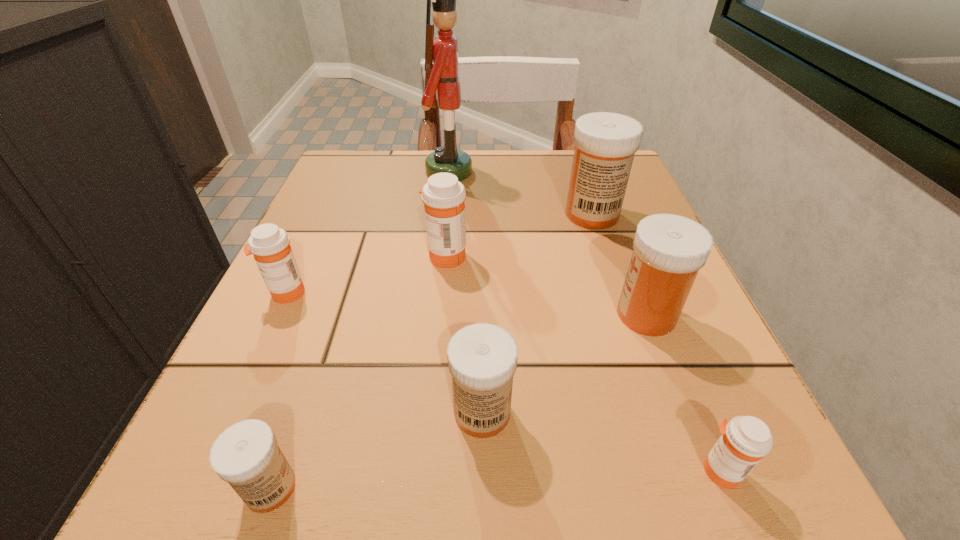
This screenshot has width=960, height=540. I want to click on orange medicine that is the second closest one to the tallest medicine, so click(745, 440).

The height and width of the screenshot is (540, 960). Find the location of `vacant area in the image that satisfies the following two spatial constraints: 1. on the back side of the second smallest white medicine; 2. on the front-facing side of the nutcracker`. vacant area in the image that satisfies the following two spatial constraints: 1. on the back side of the second smallest white medicine; 2. on the front-facing side of the nutcracker is located at coordinates (481, 172).

This screenshot has height=540, width=960. I want to click on free space that satisfies the following two spatial constraints: 1. on the back side of the second farthest object; 2. on the front-facing side of the farthest object, so click(578, 172).

The width and height of the screenshot is (960, 540). Find the location of `free region that satisfies the following two spatial constraints: 1. on the front-facing side of the green nutcracker; 2. on the front side of the leftmost medicine`. free region that satisfies the following two spatial constraints: 1. on the front-facing side of the green nutcracker; 2. on the front side of the leftmost medicine is located at coordinates (436, 292).

Where is `vacant area in the image that satisfies the following two spatial constraints: 1. on the front side of the nearest orange medicine; 2. on the left side of the farthest medicine`? vacant area in the image that satisfies the following two spatial constraints: 1. on the front side of the nearest orange medicine; 2. on the left side of the farthest medicine is located at coordinates (678, 471).

Find the location of `free location that satisfies the following two spatial constraints: 1. on the front-facing side of the seventh nearest object; 2. on the right side of the nutcracker`. free location that satisfies the following two spatial constraints: 1. on the front-facing side of the seventh nearest object; 2. on the right side of the nutcracker is located at coordinates (444, 214).

Identify the location of vacant area that satisfies the following two spatial constraints: 1. on the front-facing side of the green nutcracker; 2. on the right side of the sixth nearest medicine. (440, 256).